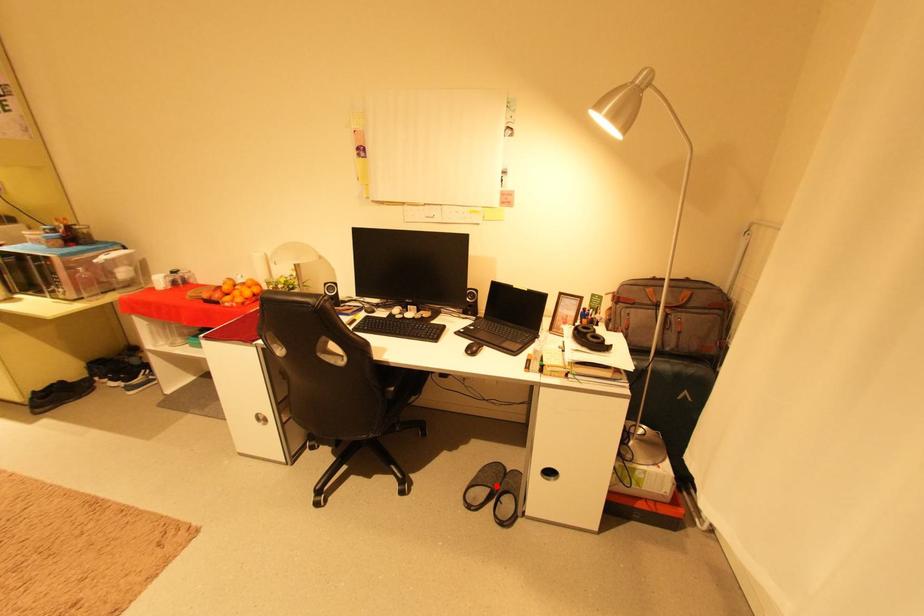
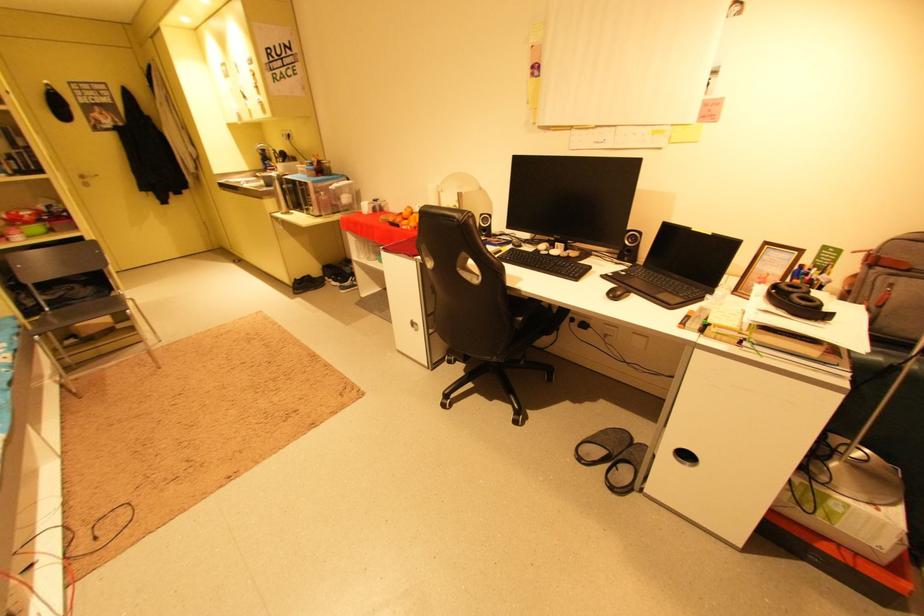
Where in the second image is the point corresponding to the highlighted location from the first image?

(616, 448)